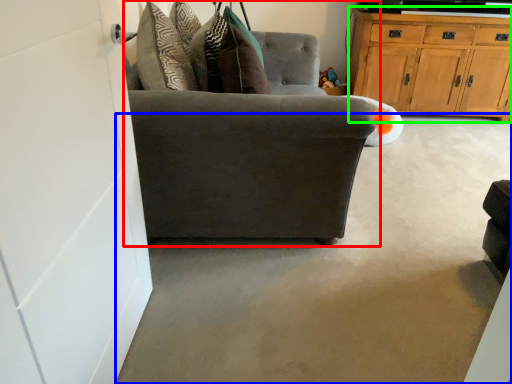
Question: Considering the real-world distances, which object is farthest from chair (highlighted by a red box)? concrete (highlighted by a blue box) or cabinetry (highlighted by a green box)?

Choices:
 (A) concrete
 (B) cabinetry

Answer: (B)